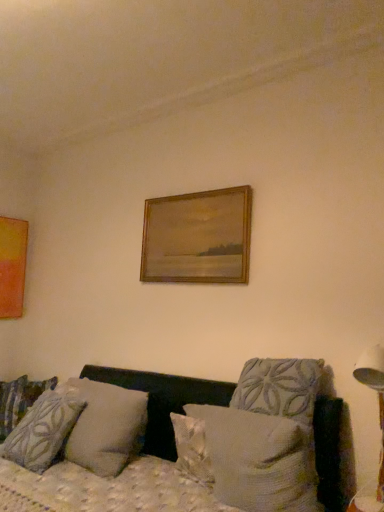
Question: Would you say white plastic table lamp at right is a long distance from textured gray pillow at lower left, the second pillow viewed from the front?

Choices:
 (A) no
 (B) yes

Answer: (B)

Question: Is white plastic table lamp at right bigger than textured gray pillow at lower left, the third pillow from the right?

Choices:
 (A) yes
 (B) no

Answer: (B)

Question: Is white plastic table lamp at right oriented towards textured gray pillow at lower left, the third pillow from the right?

Choices:
 (A) no
 (B) yes

Answer: (A)

Question: Does white plastic table lamp at right contain textured gray pillow at lower left, the third pillow from the right?

Choices:
 (A) yes
 (B) no

Answer: (B)

Question: From a real-world perspective, is white plastic table lamp at right located higher than textured gray pillow at lower left, which is counted as the third pillow, starting from the back?

Choices:
 (A) no
 (B) yes

Answer: (B)

Question: Does white plastic table lamp at right come in front of textured gray pillow at lower left, the third pillow from the right?

Choices:
 (A) no
 (B) yes

Answer: (B)

Question: Does textured gray pillow at lower left, the third pillow from the right, turn towards textured beige pillow at center, which is the 4th pillow in back-to-front order?

Choices:
 (A) no
 (B) yes

Answer: (A)

Question: Does textured gray pillow at lower left, the second pillow viewed from the front, have a smaller size compared to textured beige pillow at center, which ranks as the 4th pillow in left-to-right order?

Choices:
 (A) yes
 (B) no

Answer: (B)

Question: Considering the relative sizes of textured gray pillow at lower left, which is counted as the third pillow, starting from the back, and textured beige pillow at center, the first pillow from the front, in the image provided, is textured gray pillow at lower left, which is counted as the third pillow, starting from the back, shorter than textured beige pillow at center, the first pillow from the front,?

Choices:
 (A) yes
 (B) no

Answer: (B)

Question: From a real-world perspective, is textured gray pillow at lower left, the second pillow viewed from the front, located beneath textured beige pillow at center, the first pillow from the front?

Choices:
 (A) yes
 (B) no

Answer: (B)

Question: Can you confirm if textured gray pillow at lower left, placed as the 2th pillow when sorted from left to right, is positioned to the left of textured beige pillow at center, which ranks as the 4th pillow in left-to-right order?

Choices:
 (A) no
 (B) yes

Answer: (B)

Question: Is textured gray pillow at lower left, the third pillow from the right, directly adjacent to textured beige pillow at center, which is the 4th pillow in back-to-front order?

Choices:
 (A) yes
 (B) no

Answer: (B)

Question: Is matte orange picture frame at left, acting as the 2th picture frame starting from the front, outside of textured fabric couch at lower center?

Choices:
 (A) no
 (B) yes

Answer: (B)